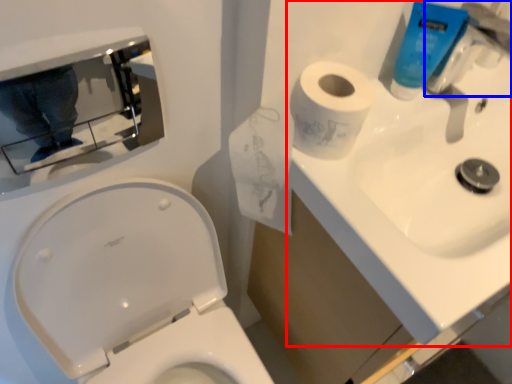
Question: Which of the following is the closest to the observer, sink (highlighted by a red box) or faucet (highlighted by a blue box)?

Choices:
 (A) sink
 (B) faucet

Answer: (A)